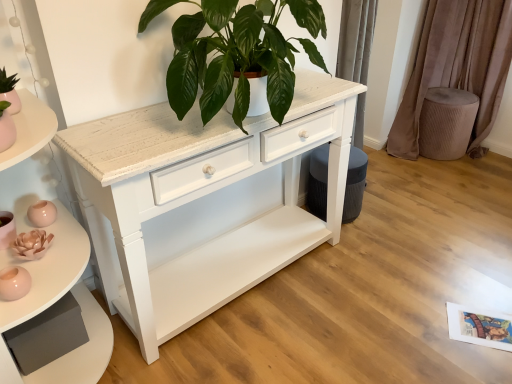
Question: Does point (92, 375) appear closer or farther from the camera than point (435, 144)?

Choices:
 (A) farther
 (B) closer

Answer: (B)

Question: Considering their positions, is white painted wood shelf at left located in front of or behind velvet taupe stool at right?

Choices:
 (A) front
 (B) behind

Answer: (A)

Question: Estimate the real-world distances between objects in this image. Which object is closer to the velvet taupe curtain at right?

Choices:
 (A) white painted wood shelf at left
 (B) velvet taupe stool at right
 (C) green matte plant at center
 (D) white wood chest of drawers at center

Answer: (B)

Question: Based on their relative distances, which object is nearer to the velvet taupe stool at right?

Choices:
 (A) green matte plant at center
 (B) velvet taupe curtain at right
 (C) white painted wood shelf at left
 (D) white wood chest of drawers at center

Answer: (B)